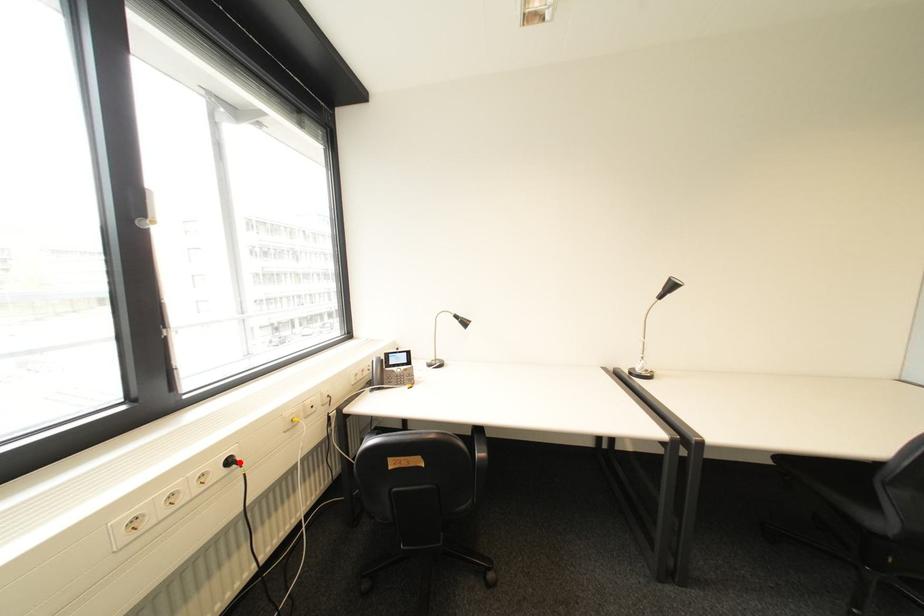
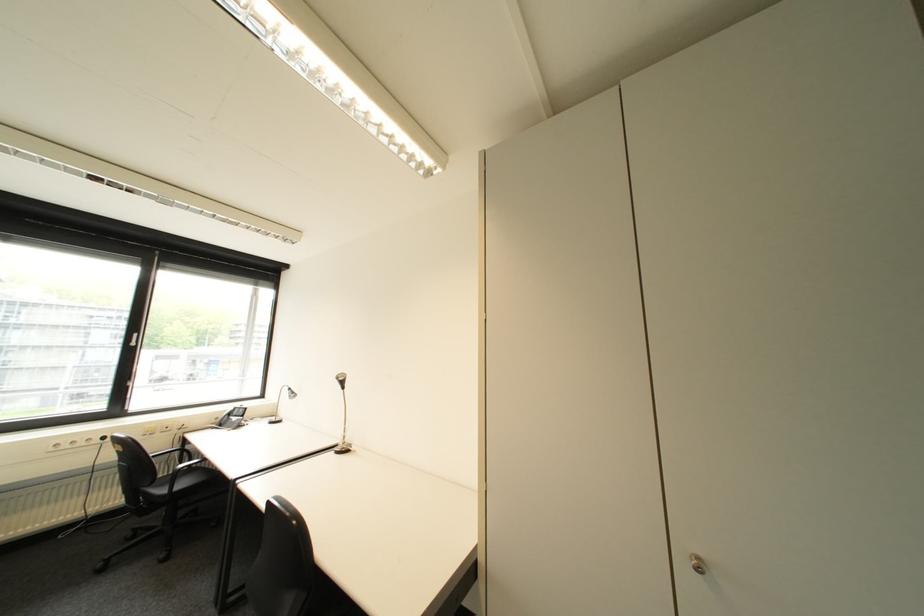
Find the pixel in the second image that matches the highlighted location in the first image.

(114, 439)